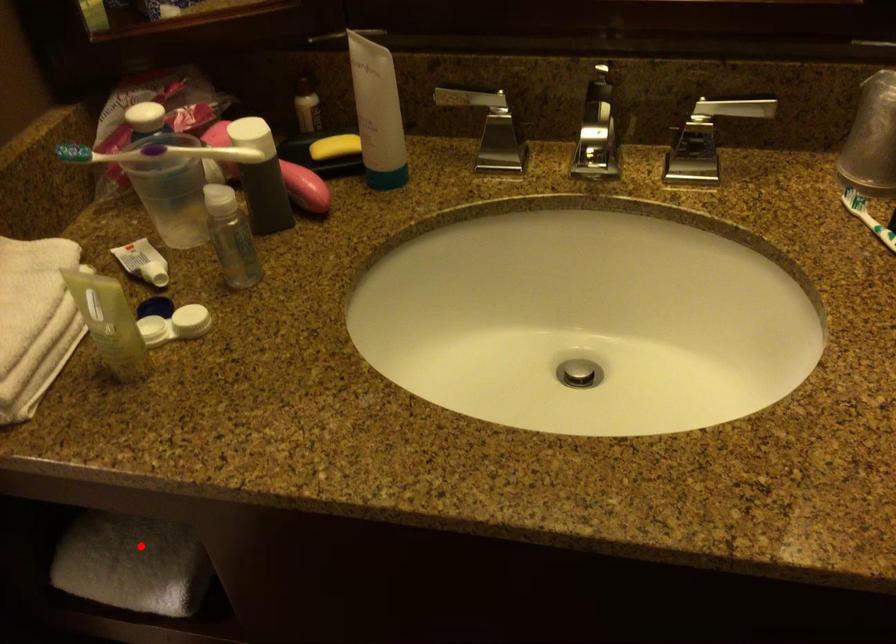
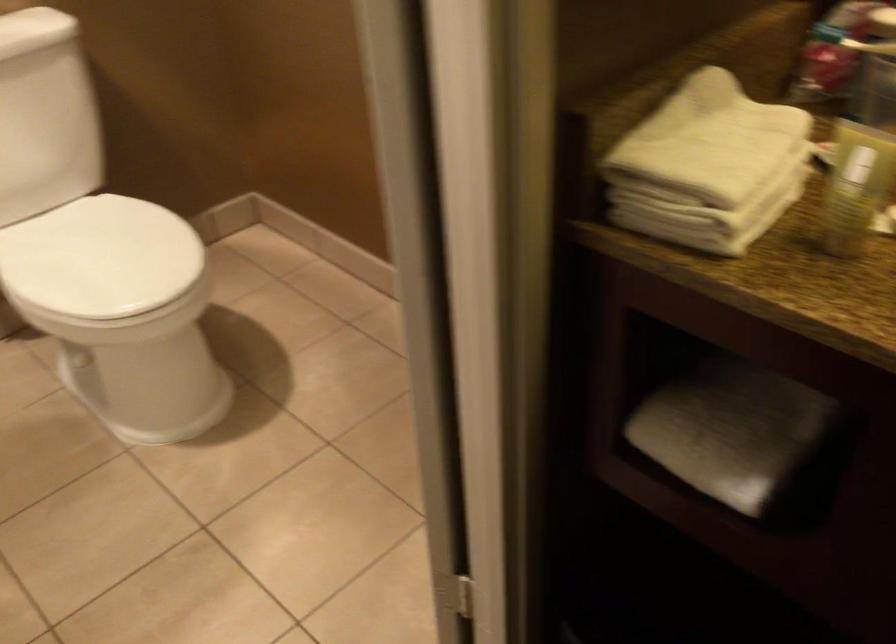
Locate, in the second image, the point that corresponds to the highlighted location in the first image.

(730, 431)